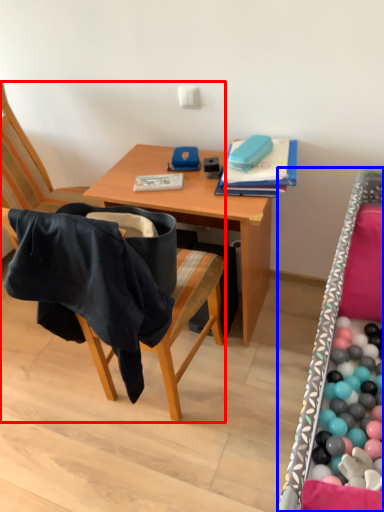
Question: Among these objects, which one is nearest to the camera, chair (highlighted by a red box) or bed frame (highlighted by a blue box)?

Choices:
 (A) chair
 (B) bed frame

Answer: (B)